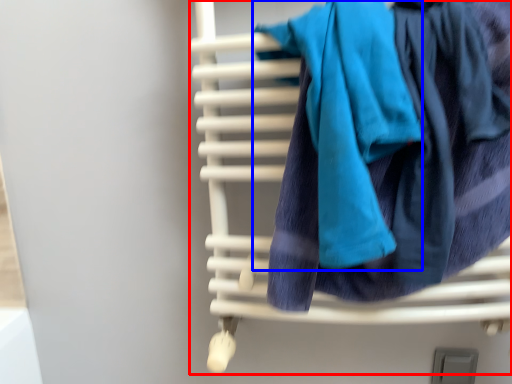
Question: Among these objects, which one is nearest to the camera, furniture (highlighted by a red box) or bath towel (highlighted by a blue box)?

Choices:
 (A) furniture
 (B) bath towel

Answer: (B)